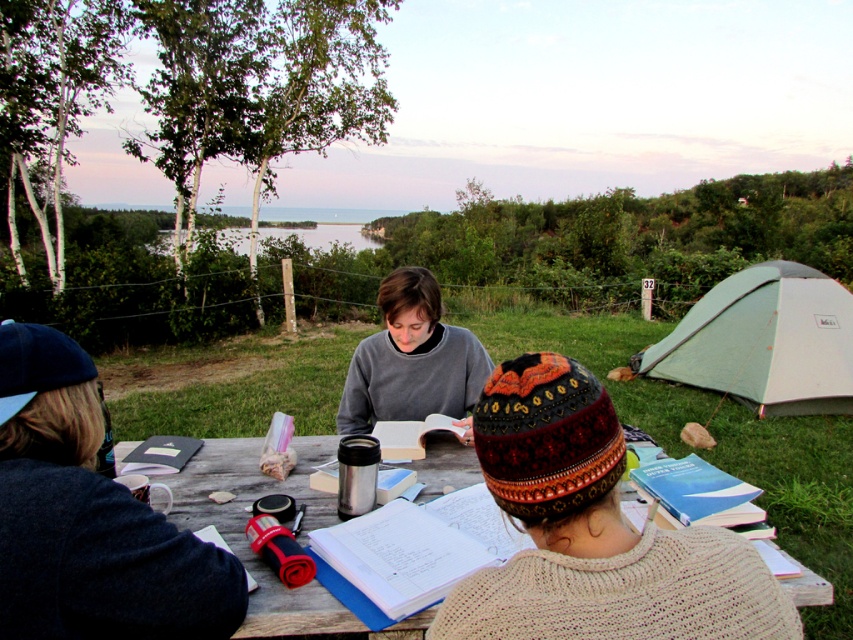
Can you confirm if white fabric tent at right is shorter than wooden table at center?

In fact, white fabric tent at right may be taller than wooden table at center.

Is white fabric tent at right wider than wooden table at center?

Yes.

Image resolution: width=853 pixels, height=640 pixels. I want to click on white fabric tent at right, so click(764, 340).

Find the location of a particular element. Image resolution: width=853 pixels, height=640 pixels. white fabric tent at right is located at coordinates (764, 340).

Is point (563, 403) closer to camera compared to point (746, 317)?

Yes, point (563, 403) is closer to viewer.

This screenshot has height=640, width=853. What do you see at coordinates (593, 531) in the screenshot? I see `knitted woolen hat at lower right` at bounding box center [593, 531].

What do you see at coordinates (593, 531) in the screenshot?
I see `knitted woolen hat at lower right` at bounding box center [593, 531].

Find the location of a particular element. The height and width of the screenshot is (640, 853). knitted woolen hat at lower right is located at coordinates (593, 531).

Which is more to the left, wooden table at center or gray sweater at center?

From the viewer's perspective, wooden table at center appears more on the left side.

Is wooden table at center below gray sweater at center?

Correct, wooden table at center is located below gray sweater at center.

Between point (119, 448) and point (358, 403), which one is positioned in front?

Positioned in front is point (119, 448).

At what (x,y) coordinates should I click in order to perform the action: click on wooden table at center. Please return your answer as a coordinate pair (x, y). Looking at the image, I should click on (244, 522).